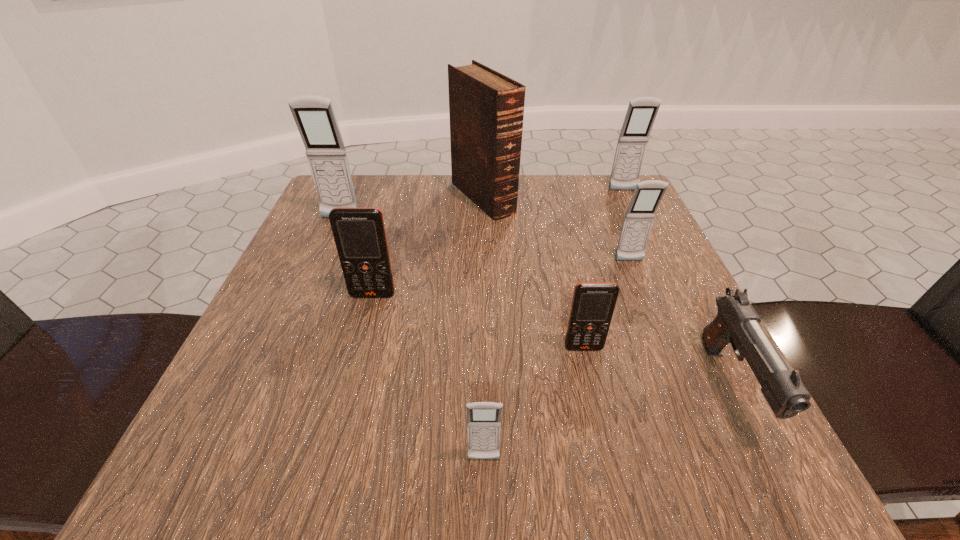
I want to click on Bible present at the far edge, so click(x=486, y=108).

The width and height of the screenshot is (960, 540). I want to click on cellular telephone located at the near edge, so click(x=483, y=418).

The height and width of the screenshot is (540, 960). What are the coordinates of `gun at the near edge` in the screenshot? It's located at (736, 322).

Where is `gun that is at the right edge`? gun that is at the right edge is located at coordinates (736, 322).

Where is `object at the far left corner`? object at the far left corner is located at coordinates (314, 116).

Find the location of a particular element. Image resolution: width=960 pixels, height=540 pixels. object positioned at the far right corner is located at coordinates (641, 113).

The image size is (960, 540). In order to click on object situated at the near right corner in this screenshot , I will do `click(736, 322)`.

In the image, there is a desktop. At what (x,y) coordinates should I click in order to perform the action: click on vacant space at the far edge. Please return your answer as a coordinate pair (x, y). Looking at the image, I should click on (464, 231).

Locate an element on the screen. vacant position at the left edge of the desktop is located at coordinates (297, 321).

Image resolution: width=960 pixels, height=540 pixels. What are the coordinates of `vacant region at the right edge of the desktop` in the screenshot? It's located at (655, 401).